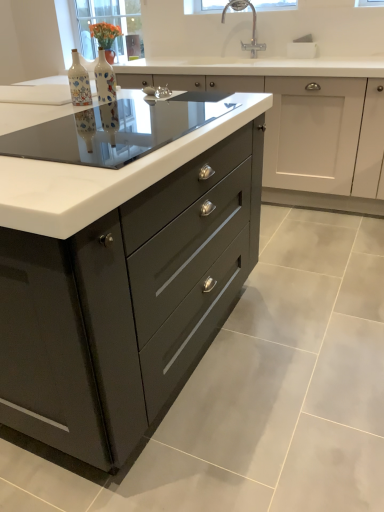
In order to face glossy dark gray cabinet at center, the first cabinetry viewed from the front, should I rotate leftwards or rightwards?

Rotate left and turn 22.756 degrees.

The image size is (384, 512). Identify the location of chrome metallic faucet at upper center. (252, 25).

Measure the distance between point (89, 81) and camera.

They are 1.78 meters apart.

In order to click on clear glass window screen at upper center, which is counted as the first window screen, starting from the right in this screenshot , I will do `click(204, 6)`.

Consider the image. Measure the distance between point (207, 69) and camera.

9.19 feet.

I want to click on transparent glass table at center, so click(116, 128).

This screenshot has width=384, height=512. What do you see at coordinates (116, 128) in the screenshot?
I see `transparent glass table at center` at bounding box center [116, 128].

The height and width of the screenshot is (512, 384). I want to click on glossy dark gray cabinet at center, the first cabinetry viewed from the front, so click(123, 278).

Which window screen is the 2nd one when counting from the back of the chrome metallic faucet at upper center? Please provide its 2D coordinates.

[(113, 25)]

Consider the image. Can you confirm if matte glass vase at upper left, which is the first window screen from left to right, is shorter than chrome metallic faucet at upper center?

Incorrect, the height of matte glass vase at upper left, which is the first window screen from left to right, does not fall short of that of chrome metallic faucet at upper center.

From the image's perspective, is matte glass vase at upper left, which is the first window screen from left to right, on top of chrome metallic faucet at upper center?

Yes.

Between matte glass vase at upper left, arranged as the first window screen when viewed from the back, and chrome metallic faucet at upper center, which one has larger width?

Wider between the two is matte glass vase at upper left, arranged as the first window screen when viewed from the back.

Who is smaller, transparent glass table at center or matte black drawers at center, which appears as the 2th cabinetry when viewed from the front?

transparent glass table at center is smaller.

Find the location of a particular element. Image resolution: width=384 pixels, height=512 pixels. glass table lying on the left of matte black drawers at center, which appears as the 2th cabinetry when viewed from the front is located at coordinates (116, 128).

Considering the points (208, 117) and (319, 165), which point is in front, point (208, 117) or point (319, 165)?

Positioned in front is point (208, 117).

Which is behind, transparent glass table at center or matte black drawers at center, which appears as the 2th cabinetry when viewed from the front?

matte black drawers at center, which appears as the 2th cabinetry when viewed from the front, is behind.

Based on the photo, does matte glass vase at upper left, which is the first window screen from left to right, have a larger size compared to glossy dark gray cabinet at center, marked as the second cabinetry in a back-to-front arrangement?

No, matte glass vase at upper left, which is the first window screen from left to right, is not bigger than glossy dark gray cabinet at center, marked as the second cabinetry in a back-to-front arrangement.

Looking at this image, is matte glass vase at upper left, which is the second window screen in front-to-back order, positioned with its back to glossy dark gray cabinet at center, the first cabinetry viewed from the front?

matte glass vase at upper left, which is the second window screen in front-to-back order, is not turned away from glossy dark gray cabinet at center, the first cabinetry viewed from the front.

From their relative heights in the image, would you say matte glass vase at upper left, arranged as the first window screen when viewed from the back, is taller or shorter than glossy dark gray cabinet at center, the first cabinetry viewed from the front?

Considering their sizes, matte glass vase at upper left, arranged as the first window screen when viewed from the back, has less height than glossy dark gray cabinet at center, the first cabinetry viewed from the front.

Considering the positions of objects matte glass vase at upper left, which is the first window screen from left to right, and glossy dark gray cabinet at center, the first cabinetry viewed from the front, in the image provided, who is more to the right, matte glass vase at upper left, which is the first window screen from left to right, or glossy dark gray cabinet at center, the first cabinetry viewed from the front,?

Positioned to the right is matte glass vase at upper left, which is the first window screen from left to right.

Does chrome metallic faucet at upper center appear on the right side of matte black drawers at center, which appears as the 2th cabinetry when viewed from the front?

No, chrome metallic faucet at upper center is not to the right of matte black drawers at center, which appears as the 2th cabinetry when viewed from the front.

Between chrome metallic faucet at upper center and matte black drawers at center, which appears as the 2th cabinetry when viewed from the front, which one has more height?

matte black drawers at center, which appears as the 2th cabinetry when viewed from the front, is taller.

Choose the correct answer: Is chrome metallic faucet at upper center inside matte black drawers at center, the first cabinetry viewed from the back, or outside it?

chrome metallic faucet at upper center is not enclosed by matte black drawers at center, the first cabinetry viewed from the back.

This screenshot has height=512, width=384. I want to click on tap above the matte black drawers at center, which appears as the 2th cabinetry when viewed from the front (from a real-world perspective), so click(252, 25).

Is matte black drawers at center, the first cabinetry viewed from the back, positioned with its back to matte ceramic vase at center, which is the 1th bottle in right-to-left order?

That's not correct — matte black drawers at center, the first cabinetry viewed from the back, is not looking away from matte ceramic vase at center, which is the 1th bottle in right-to-left order.

I want to click on cabinetry on the right side of matte ceramic vase at center, arranged as the 2th bottle when viewed from the left, so click(300, 123).

Can you tell me how much matte black drawers at center, the first cabinetry viewed from the back, and matte ceramic vase at center, arranged as the 2th bottle when viewed from the left, differ in facing direction?

89.7 degrees separate the facing orientations of matte black drawers at center, the first cabinetry viewed from the back, and matte ceramic vase at center, arranged as the 2th bottle when viewed from the left.

Is matte black drawers at center, which appears as the 2th cabinetry when viewed from the front, taller or shorter than matte ceramic vase at center, which is the 1th bottle in right-to-left order?

In the image, matte black drawers at center, which appears as the 2th cabinetry when viewed from the front, appears to be taller than matte ceramic vase at center, which is the 1th bottle in right-to-left order.

What's the angular difference between transparent glass table at center and decorative ceramic bottle at center, the 2th bottle viewed from the right,'s facing directions?

transparent glass table at center and decorative ceramic bottle at center, the 2th bottle viewed from the right, are facing 179 degrees away from each other.

Is transparent glass table at center behind decorative ceramic bottle at center, which is the 1th bottle in left-to-right order?

No, the depth of transparent glass table at center is less than that of decorative ceramic bottle at center, which is the 1th bottle in left-to-right order.

Is transparent glass table at center taller or shorter than decorative ceramic bottle at center, the 2th bottle viewed from the right?

Considering their sizes, transparent glass table at center has less height than decorative ceramic bottle at center, the 2th bottle viewed from the right.

Would you say transparent glass table at center is a long distance from decorative ceramic bottle at center, the 2th bottle viewed from the right?

No, there isn't a large distance between transparent glass table at center and decorative ceramic bottle at center, the 2th bottle viewed from the right.

Can you confirm if glossy dark gray cabinet at center, marked as the second cabinetry in a back-to-front arrangement, is wider than decorative ceramic bottle at center, which is the 1th bottle in left-to-right order?

Indeed, glossy dark gray cabinet at center, marked as the second cabinetry in a back-to-front arrangement, has a greater width compared to decorative ceramic bottle at center, which is the 1th bottle in left-to-right order.

From a real-world perspective, is glossy dark gray cabinet at center, the first cabinetry viewed from the front, physically above decorative ceramic bottle at center, the 2th bottle viewed from the right?

No.

Looking at this image, is the depth of glossy dark gray cabinet at center, marked as the second cabinetry in a back-to-front arrangement, less than that of decorative ceramic bottle at center, the 2th bottle viewed from the right?

That is True.

Where is `tap that appears below the matte glass vase at upper left, placed as the 2th window screen when sorted from right to left (from the image's perspective)`? tap that appears below the matte glass vase at upper left, placed as the 2th window screen when sorted from right to left (from the image's perspective) is located at coordinates (252, 25).

Identify the location of cabinetry above the transparent glass table at center (from the image's perspective). (300, 123).

Considering their positions, is clear glass window screen at upper center, which is counted as the 2th window screen, starting from the left, positioned closer to matte ceramic vase at center, which is the 1th bottle in right-to-left order, than chrome metallic faucet at upper center?

chrome metallic faucet at upper center is closer to matte ceramic vase at center, which is the 1th bottle in right-to-left order.

Which object lies nearer to the anchor point matte black drawers at center, the first cabinetry viewed from the back, transparent glass table at center or matte glass vase at upper left, which is the first window screen from left to right?

Among the two, matte glass vase at upper left, which is the first window screen from left to right, is located nearer to matte black drawers at center, the first cabinetry viewed from the back.

Based on their spatial positions, is transparent glass table at center or matte black drawers at center, the first cabinetry viewed from the back, further from clear glass window screen at upper center, which is counted as the 2th window screen, starting from the left?

transparent glass table at center is further to clear glass window screen at upper center, which is counted as the 2th window screen, starting from the left.

Based on their spatial positions, is matte ceramic vase at center, which is the 1th bottle in right-to-left order, or matte glass vase at upper left, which is the first window screen from left to right, further from chrome metallic faucet at upper center?

matte ceramic vase at center, which is the 1th bottle in right-to-left order, is positioned further to the anchor chrome metallic faucet at upper center.

Consider the image. Estimate the real-world distances between objects in this image. Which object is closer to glossy dark gray cabinet at center, marked as the second cabinetry in a back-to-front arrangement, clear glass window screen at upper center, which is counted as the first window screen, starting from the right, or matte glass vase at upper left, arranged as the first window screen when viewed from the back?

Based on the image, clear glass window screen at upper center, which is counted as the first window screen, starting from the right, appears to be nearer to glossy dark gray cabinet at center, marked as the second cabinetry in a back-to-front arrangement.

Considering their positions, is clear glass window screen at upper center, which is counted as the 2th window screen, starting from the left, positioned further to matte black drawers at center, the first cabinetry viewed from the back, than decorative ceramic bottle at center, the 2th bottle viewed from the right?

decorative ceramic bottle at center, the 2th bottle viewed from the right, is further to matte black drawers at center, the first cabinetry viewed from the back.

Based on their spatial positions, is matte ceramic vase at center, arranged as the 2th bottle when viewed from the left, or decorative ceramic bottle at center, the 2th bottle viewed from the right, further from clear glass window screen at upper center, which is counted as the 2th window screen, starting from the left?

matte ceramic vase at center, arranged as the 2th bottle when viewed from the left, lies further to clear glass window screen at upper center, which is counted as the 2th window screen, starting from the left, than the other object.

Which object lies further to the anchor point matte glass vase at upper left, arranged as the first window screen when viewed from the back, clear glass window screen at upper center, the 1th window screen viewed from the front, or matte ceramic vase at center, which is the 1th bottle in right-to-left order?

Based on the image, matte ceramic vase at center, which is the 1th bottle in right-to-left order, appears to be further to matte glass vase at upper left, arranged as the first window screen when viewed from the back.

At what (x,y) coordinates should I click in order to perform the action: click on cabinetry located between decorative ceramic bottle at center, which is the 1th bottle in left-to-right order, and matte glass vase at upper left, arranged as the first window screen when viewed from the back, in the depth direction. Please return your answer as a coordinate pair (x, y). This screenshot has width=384, height=512. Looking at the image, I should click on (300, 123).

Where is `bottle located between decorative ceramic bottle at center, the 2th bottle viewed from the right, and chrome metallic faucet at upper center in the depth direction`? bottle located between decorative ceramic bottle at center, the 2th bottle viewed from the right, and chrome metallic faucet at upper center in the depth direction is located at coordinates (104, 79).

Locate an element on the screen. The image size is (384, 512). glass table between glossy dark gray cabinet at center, the first cabinetry viewed from the front, and clear glass window screen at upper center, the 1th window screen viewed from the front, along the z-axis is located at coordinates (116, 128).

Locate an element on the screen. tap between glossy dark gray cabinet at center, the first cabinetry viewed from the front, and matte glass vase at upper left, arranged as the first window screen when viewed from the back, in the front-back direction is located at coordinates (252, 25).